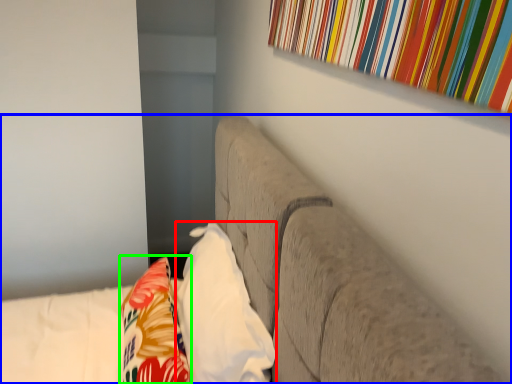
Question: Estimate the real-world distances between objects in this image. Which object is closer to pillow (highlighted by a red box), furniture (highlighted by a blue box) or throw pillow (highlighted by a green box)?

Choices:
 (A) furniture
 (B) throw pillow

Answer: (B)